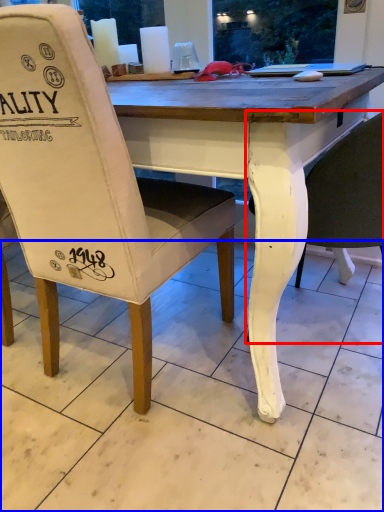
Question: Which object appears farthest to the camera in this image, chair (highlighted by a red box) or tile (highlighted by a blue box)?

Choices:
 (A) chair
 (B) tile

Answer: (A)